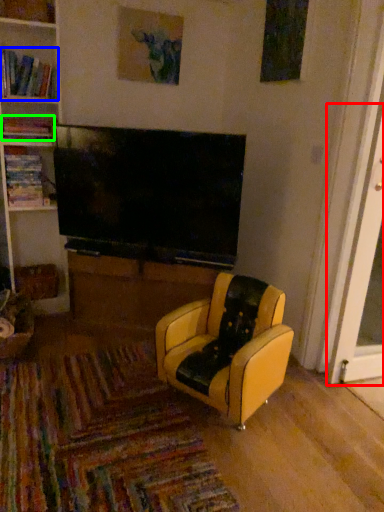
Question: Based on their relative distances, which object is farther from screen door (highlighted by a red box)? Choose from book (highlighted by a blue box) and book (highlighted by a green box).

Choices:
 (A) book
 (B) book

Answer: (A)